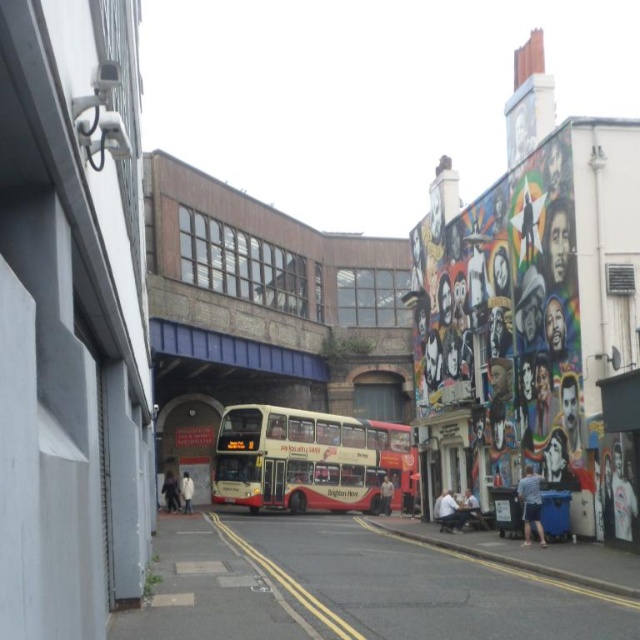
You are a delivery person who needs to drive a truck that is 4 meters tall through the blue metallic bridge at center. The red metallic bus at center is parked under the bridge. Can you safely pass under the bridge without hitting the truck roof?

The blue metallic bridge at center is not as tall as the red metallic bus at center. Since the bus is parked under the bridge and the bridge is shorter than the bus, the truck that is 4 meters tall cannot safely pass under the bridge without hitting the roof.

You are a delivery person trying to fit a large package into the space between the dark gray jacket at lower left and the light brown leather jacket at center. Can you fit it there?

The dark gray jacket at lower left occupies less space than the light brown leather jacket at center, so the space between them may be limited. The package might not fit unless it is small.

You are a delivery person trying to navigate through the street scene. You notice a white painted wall at right and a white matte jacket at center. Which object is nearer to you as you stand in the middle of the street?

→ The white painted wall at right is closer to the viewer than the white matte jacket at center, so the wall is nearer to you.